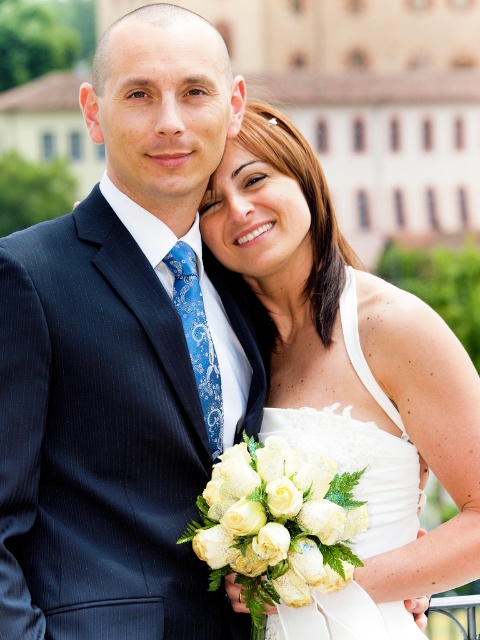
Locate an element on the screen. The height and width of the screenshot is (640, 480). matte black suit at left is located at coordinates (123, 356).

Is point (82, 410) more distant than point (215, 211)?

That is False.

Identify the location of matte black suit at left. (123, 356).

Is matte black suit at left wider than white silk bouquet at center?

Correct, the width of matte black suit at left exceeds that of white silk bouquet at center.

Does matte black suit at left have a smaller size compared to white silk bouquet at center?

No.

Is point (122, 380) positioned in front of point (273, 445)?

No.

You are a GUI agent. You are given a task and a screenshot of the screen. Output one action in this format:
    pyautogui.click(x=<x>, y=<y>)
    Task: Click on the matte black suit at left
    The width and height of the screenshot is (480, 640).
    Given the screenshot: What is the action you would take?
    pyautogui.click(x=123, y=356)

Between white satin dress at center and white silk bouquet at center, which one has less height?

white silk bouquet at center is shorter.

Consider the image. Who is more distant from viewer, (224, 246) or (247, 440)?

Point (224, 246)

Find the location of a particular element. The height and width of the screenshot is (640, 480). white satin dress at center is located at coordinates (349, 349).